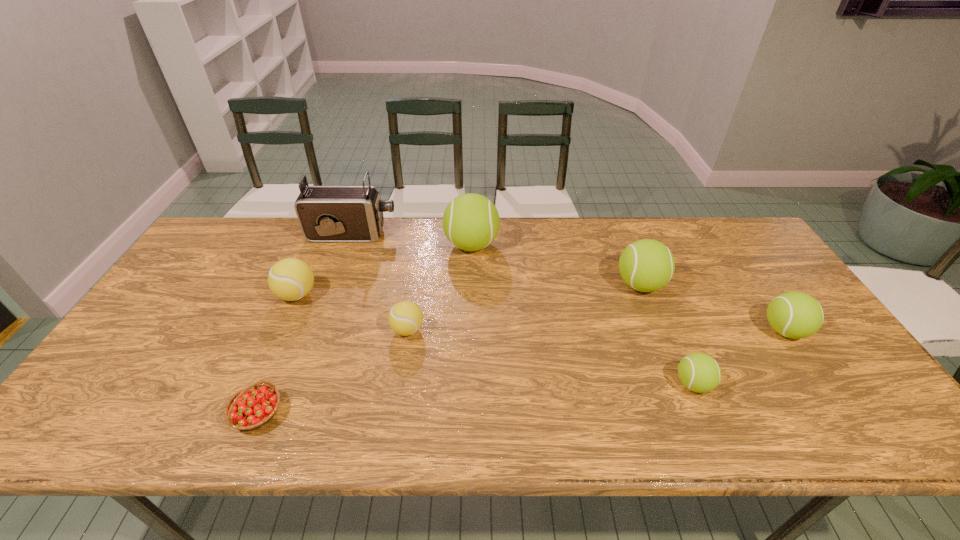
This screenshot has width=960, height=540. Identify the location of vacant space located 0.240m on the back of the right yellow tennis ball. (419, 261).

Identify the location of free space located on the back of the strawberry. This screenshot has height=540, width=960. (305, 298).

This screenshot has height=540, width=960. Identify the location of camcorder that is at the far edge. [x=325, y=213].

I want to click on tennis ball that is positioned at the far edge, so click(x=471, y=222).

Identify the location of object situated at the near edge. This screenshot has height=540, width=960. (252, 407).

The width and height of the screenshot is (960, 540). In order to click on object at the right edge in this screenshot , I will do `click(796, 315)`.

Locate an element on the screen. free spot at the far edge of the desktop is located at coordinates [362, 248].

I want to click on free space at the near edge of the desktop, so click(x=688, y=422).

Where is `free location at the left edge`? Image resolution: width=960 pixels, height=540 pixels. free location at the left edge is located at coordinates (183, 303).

You are a GUI agent. You are given a task and a screenshot of the screen. Output one action in this format:
    pyautogui.click(x=<x>, y=<y>)
    Task: Click on the vacant space at the right edge of the desktop
    The height and width of the screenshot is (540, 960).
    Given the screenshot: What is the action you would take?
    pyautogui.click(x=748, y=264)